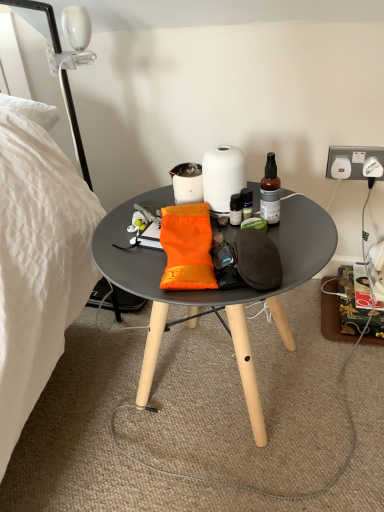
Where is `free space on the front side of white matte paper towel at center`? Image resolution: width=384 pixels, height=512 pixels. free space on the front side of white matte paper towel at center is located at coordinates (230, 248).